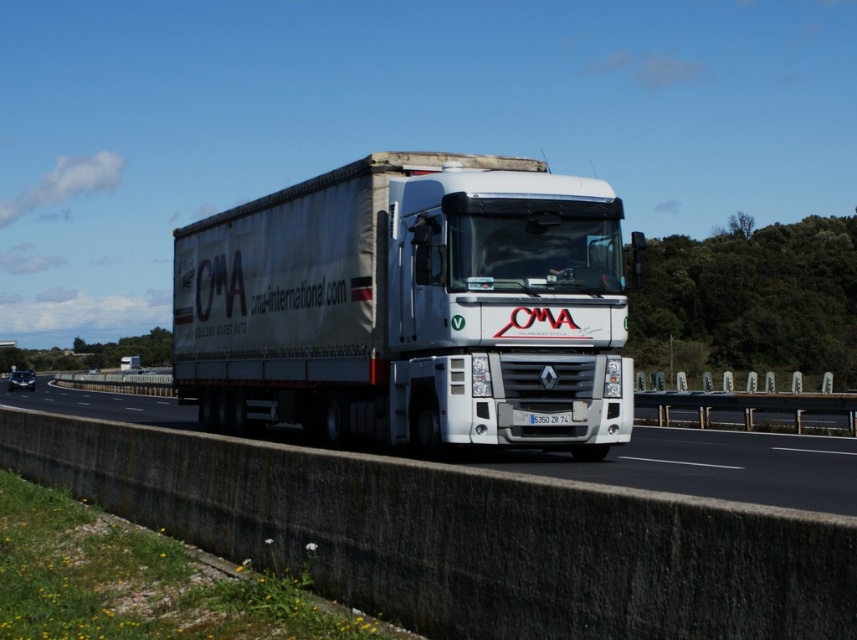
Question: In this image, where is white matte trailer truck at center located relative to white glossy truck at center?

Choices:
 (A) right
 (B) left

Answer: (A)

Question: Does white matte trailer truck at center have a larger size compared to white glossy truck at center?

Choices:
 (A) yes
 (B) no

Answer: (B)

Question: Which of the following is the farthest from the observer?

Choices:
 (A) (562, 452)
 (B) (382, 237)

Answer: (A)

Question: Among these objects, which one is nearest to the camera?

Choices:
 (A) white matte trailer truck at center
 (B) white glossy truck at center

Answer: (B)

Question: Is white matte trailer truck at center below white glossy truck at center?

Choices:
 (A) yes
 (B) no

Answer: (B)